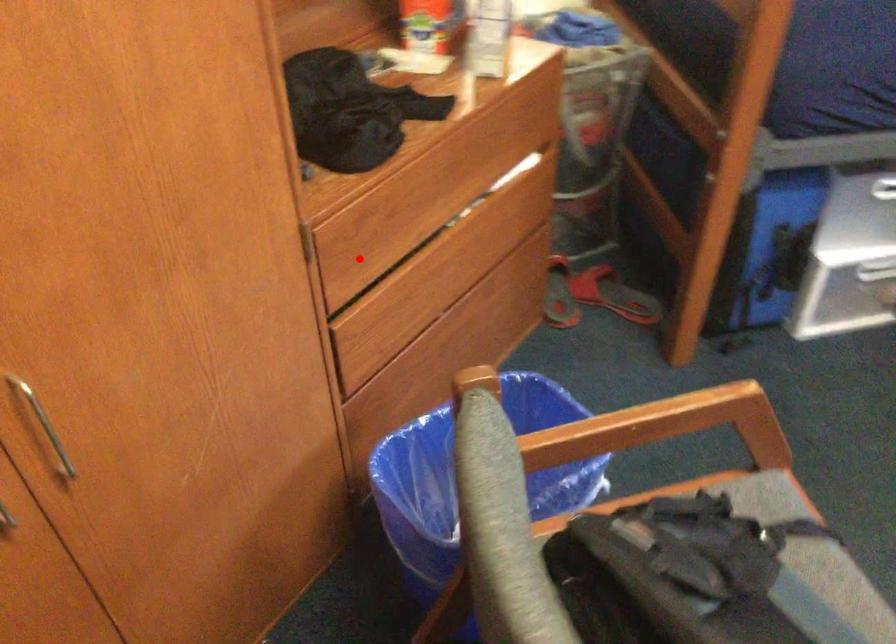
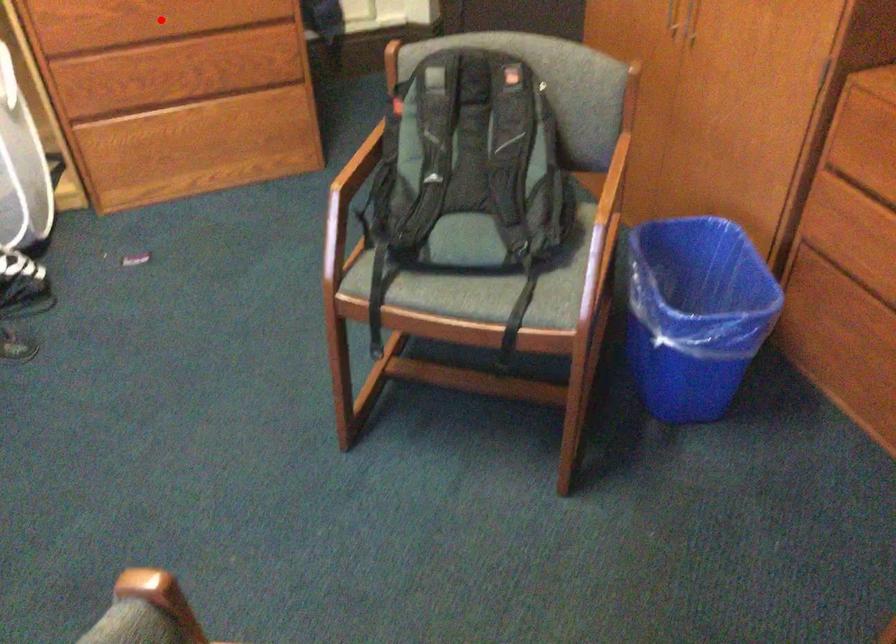
I am providing you with two images of the same scene from different viewpoints. A red point is marked on the first image and another point is marked on the second image. Is the red point in image1 aligned with the point shown in image2?

No